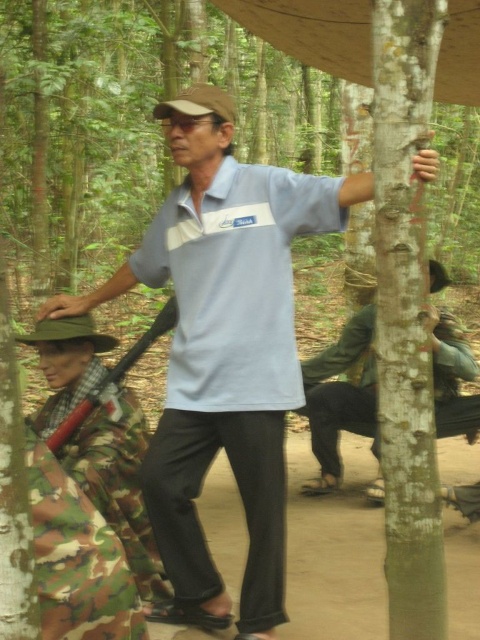
Which is more to the left, light blue cotton shirt at center or green matte uniform at center?

light blue cotton shirt at center is more to the left.

Can you confirm if light blue cotton shirt at center is smaller than green matte uniform at center?

No.

Which is in front, point (224, 349) or point (444, 353)?

Point (224, 349) is in front.

Find the location of a particular element. light blue cotton shirt at center is located at coordinates (224, 349).

Does light blue cotton shirt at center have a greater width compared to smooth bark tree at right?

Correct, the width of light blue cotton shirt at center exceeds that of smooth bark tree at right.

Does light blue cotton shirt at center appear on the right side of smooth bark tree at right?

In fact, light blue cotton shirt at center is to the left of smooth bark tree at right.

Identify the location of light blue cotton shirt at center. (224, 349).

Is point (432, 28) positioned before point (443, 374)?

Yes, point (432, 28) is in front of point (443, 374).

Who is more distant from viewer, (412, 577) or (327, 426)?

The point (327, 426) is behind.

Between point (420, 20) and point (370, 401), which one is positioned behind?

The point (370, 401) is more distant.

You are a GUI agent. You are given a task and a screenshot of the screen. Output one action in this format:
    pyautogui.click(x=<x>, y=<y>)
    Task: Click on the smooth bark tree at right
    
    Given the screenshot: What is the action you would take?
    [406, 316]